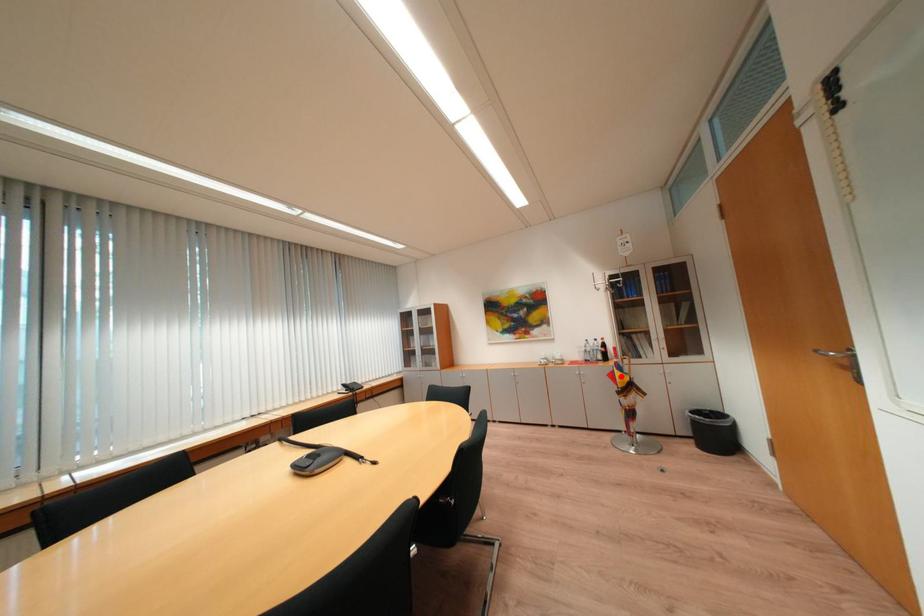
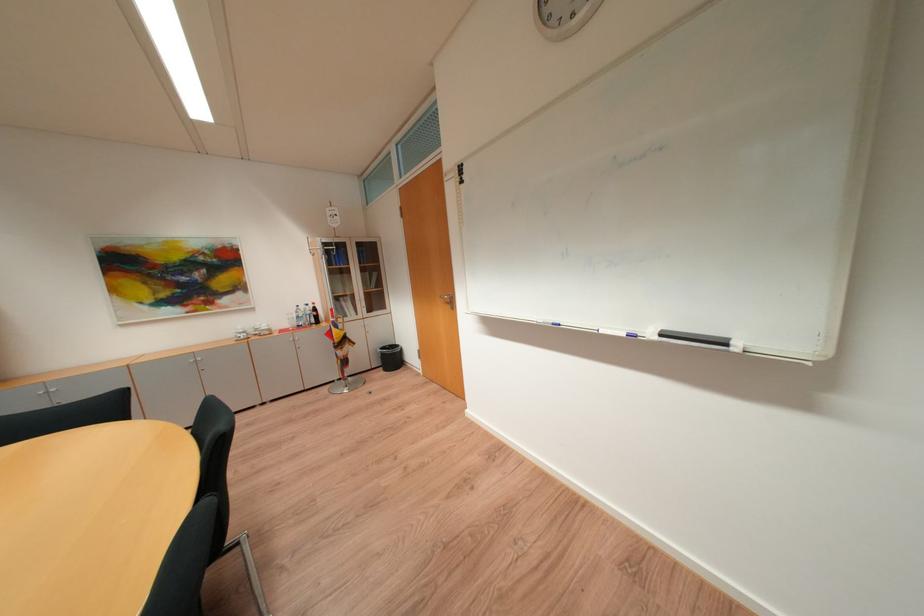
Question: I am providing you with two images of the same scene from different viewpoints. In image1, a red point is highlighted. Considering the same 3D point in image2, which of the following is correct?

Choices:
 (A) It is closer
 (B) It is farther

Answer: (A)